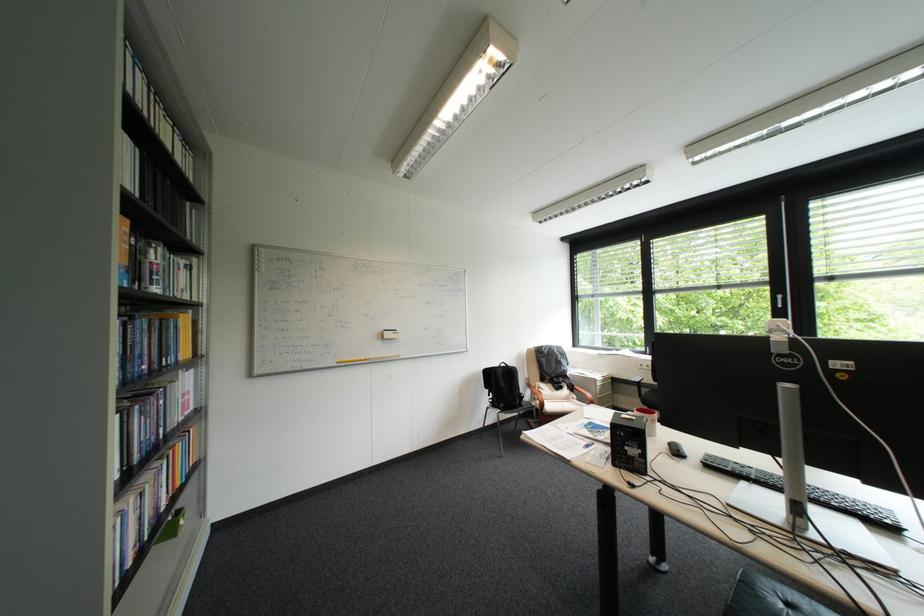
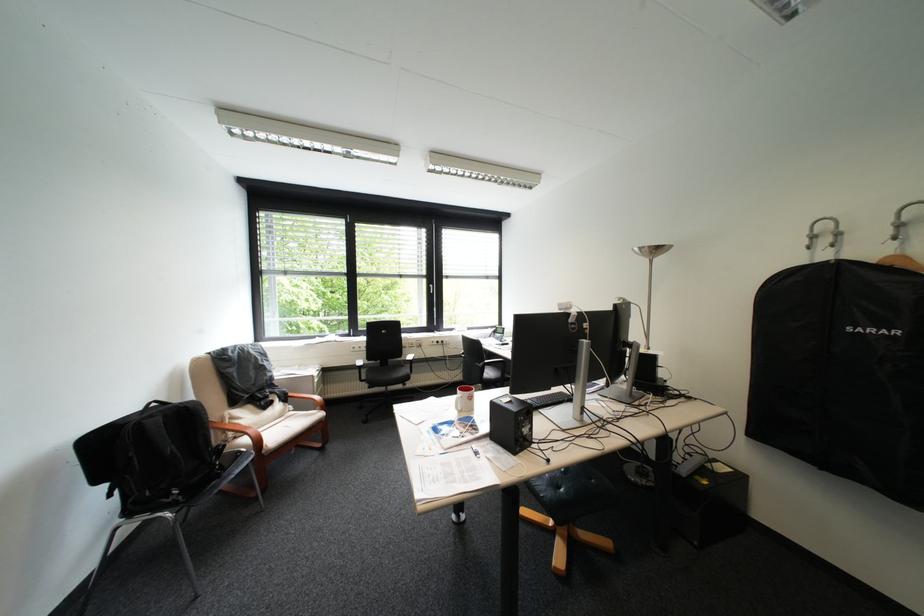
Locate, in the second image, the point that corresponds to pixel 598 438 in the first image.

(469, 446)